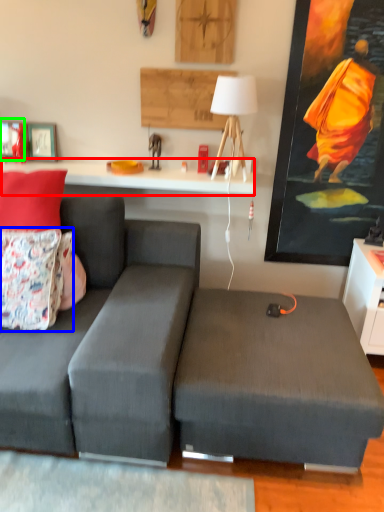
Question: Estimate the real-world distances between objects in this image. Which object is farther from table (highlighted by a red box), pillow (highlighted by a blue box) or picture frame (highlighted by a green box)?

Choices:
 (A) pillow
 (B) picture frame

Answer: (A)